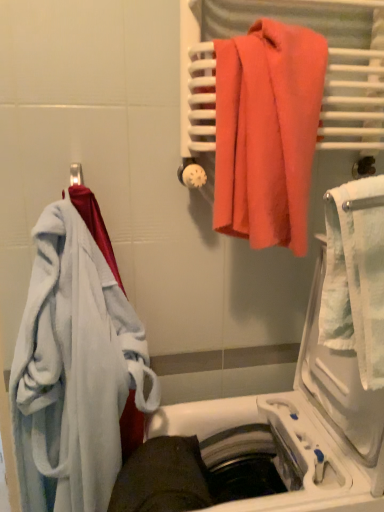
Question: Considering the positions of white plastic dishwasher at lower center and white textured towel at right in the image, is white plastic dishwasher at lower center wider or thinner than white textured towel at right?

Choices:
 (A) wide
 (B) thin

Answer: (A)

Question: Would you say white plastic dishwasher at lower center is to the left or to the right of white textured towel at right in the picture?

Choices:
 (A) right
 (B) left

Answer: (B)

Question: Which is nearer to the soft white bathrobe at left, the 1th towel when ordered from bottom to top?

Choices:
 (A) white plastic dishwasher at lower center
 (B) white textured towel at right
 (C) coral fabric towel at upper right, the second towel positioned from the left

Answer: (A)

Question: Which is farther from the soft white bathrobe at left, which is counted as the second towel, starting from the top?

Choices:
 (A) white textured towel at right
 (B) coral fabric towel at upper right, which is counted as the first towel, starting from the top
 (C) white plastic dishwasher at lower center

Answer: (A)